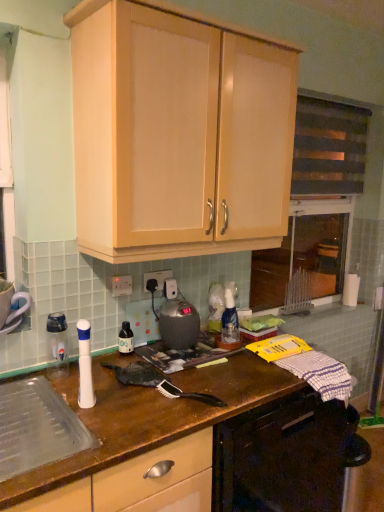
Question: Can you confirm if clear plastic bottle at left is smaller than matte wood cabinet at upper center?

Choices:
 (A) yes
 (B) no

Answer: (A)

Question: Considering the relative sizes of clear plastic bottle at left and matte wood cabinet at upper center in the image provided, is clear plastic bottle at left thinner than matte wood cabinet at upper center?

Choices:
 (A) yes
 (B) no

Answer: (A)

Question: Is clear plastic bottle at left not within matte wood cabinet at upper center?

Choices:
 (A) no
 (B) yes

Answer: (B)

Question: Is clear plastic bottle at left bigger than matte wood cabinet at upper center?

Choices:
 (A) no
 (B) yes

Answer: (A)

Question: From the image's perspective, is clear plastic bottle at left below matte wood cabinet at upper center?

Choices:
 (A) yes
 (B) no

Answer: (A)

Question: From the image's perspective, relative to white plastic electric outlet at center, positioned as the 1th electric outlet in left-to-right order, is matte black bottle at center above or below?

Choices:
 (A) above
 (B) below

Answer: (B)

Question: Does point (125, 352) appear closer or farther from the camera than point (130, 288)?

Choices:
 (A) farther
 (B) closer

Answer: (B)

Question: Looking at the image, does matte black bottle at center seem bigger or smaller compared to white plastic electric outlet at center, acting as the second electric outlet starting from the right?

Choices:
 (A) big
 (B) small

Answer: (A)

Question: Which is correct: matte black bottle at center is inside white plastic electric outlet at center, the second electric outlet from the back, or outside of it?

Choices:
 (A) outside
 (B) inside

Answer: (A)

Question: Looking at their shapes, would you say matte wood cabinet at upper center is wider or thinner than clear plastic bottle at left?

Choices:
 (A) thin
 (B) wide

Answer: (B)

Question: Is matte wood cabinet at upper center inside or outside of clear plastic bottle at left?

Choices:
 (A) inside
 (B) outside

Answer: (B)

Question: From the image's perspective, relative to clear plastic bottle at left, is matte wood cabinet at upper center above or below?

Choices:
 (A) above
 (B) below

Answer: (A)

Question: From a real-world perspective, relative to clear plastic bottle at left, is matte wood cabinet at upper center vertically above or below?

Choices:
 (A) above
 (B) below

Answer: (A)

Question: From the image's perspective, relative to matte black bottle at center, is dark fabric window screen at upper right above or below?

Choices:
 (A) above
 (B) below

Answer: (A)

Question: From a real-world perspective, is dark fabric window screen at upper right positioned above or below matte black bottle at center?

Choices:
 (A) above
 (B) below

Answer: (A)